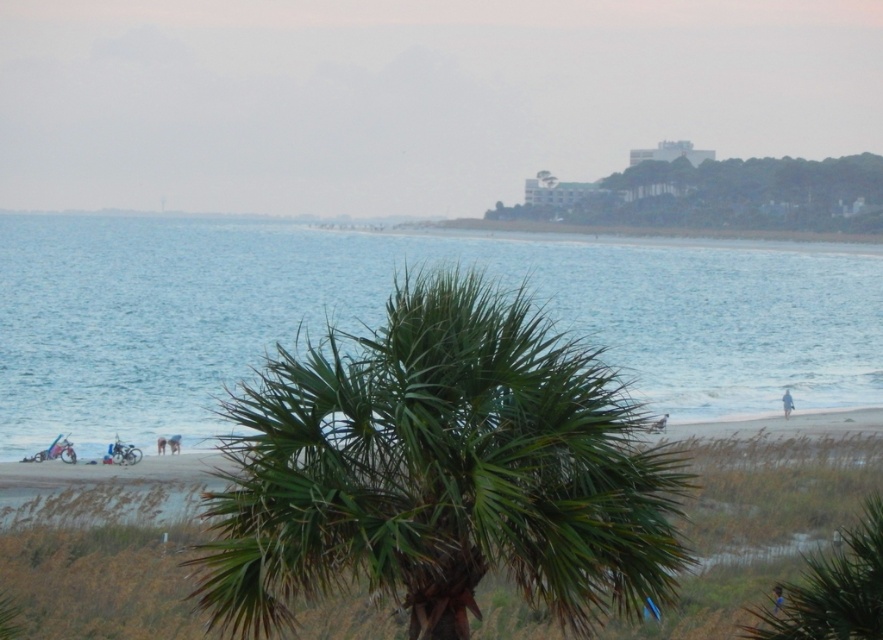
You are standing at point (x=440, y=472) on the beach. What object is exactly at your current location?

The green leafy palm tree at center is exactly at point (x=440, y=472).

You are standing at the center of the beach facing the palm tree. You want to retrieve the light blue fabric at lower right. Which direction should you walk to reach it?

The light blue fabric at lower right is located at point [786,403], which is to your right side. You should walk towards your right to reach it.